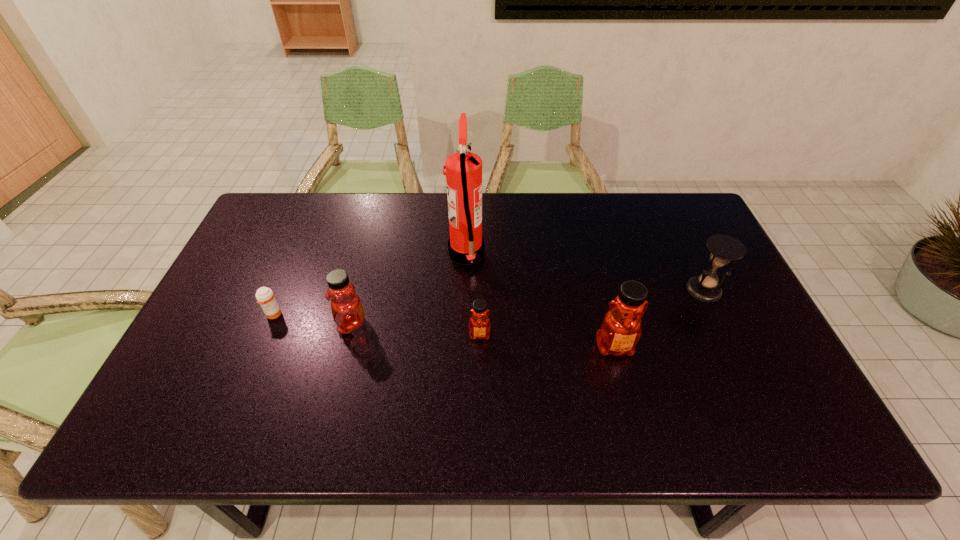
The image size is (960, 540). Find the location of `free space located on the front label of the second object from left to right`. free space located on the front label of the second object from left to right is located at coordinates (245, 323).

At what (x,y) coordinates should I click in order to perform the action: click on free spot located 0.280m on the front label of the second object from left to right. Please return your answer as a coordinate pair (x, y). Looking at the image, I should click on (229, 323).

This screenshot has width=960, height=540. I want to click on free space located 0.140m on the front label of the second honey from left to right, so click(480, 393).

Identify the location of vacant space located 0.210m with the nozzle aimed from the fire extinguisher. pos(553,254).

Where is `free region located on the back of the hourglass`? free region located on the back of the hourglass is located at coordinates (670, 219).

Find the location of a particular element. The height and width of the screenshot is (540, 960). free space located 0.350m on the back of the leftmost object is located at coordinates (311, 226).

Image resolution: width=960 pixels, height=540 pixels. In order to click on object situated at the far edge in this screenshot , I will do `click(463, 173)`.

This screenshot has height=540, width=960. In order to click on object located in the left edge section of the desktop in this screenshot , I will do `click(266, 299)`.

Identify the location of object present at the right edge. The height and width of the screenshot is (540, 960). point(724,248).

This screenshot has width=960, height=540. Find the location of `vacant space at the far edge of the desktop`. vacant space at the far edge of the desktop is located at coordinates (629, 230).